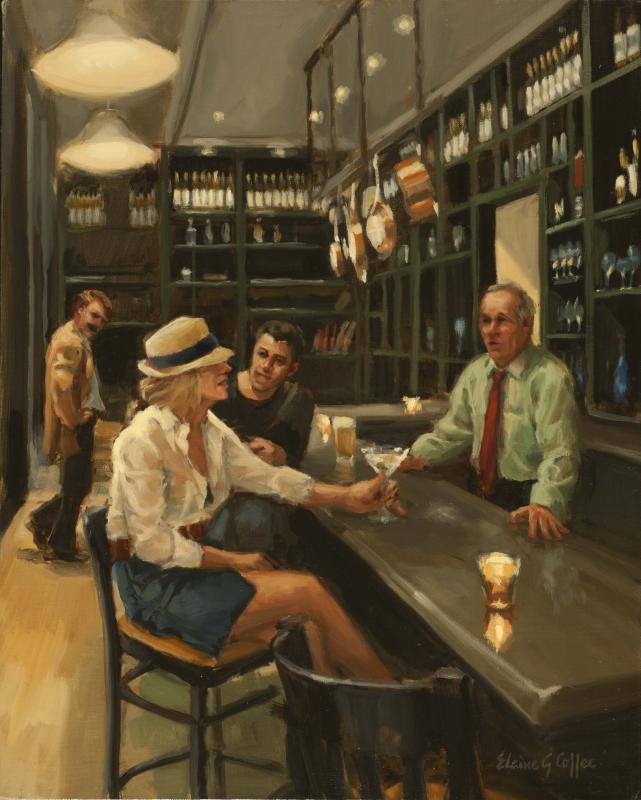
Where is `martini glass`? The image size is (641, 800). martini glass is located at coordinates (386, 462).